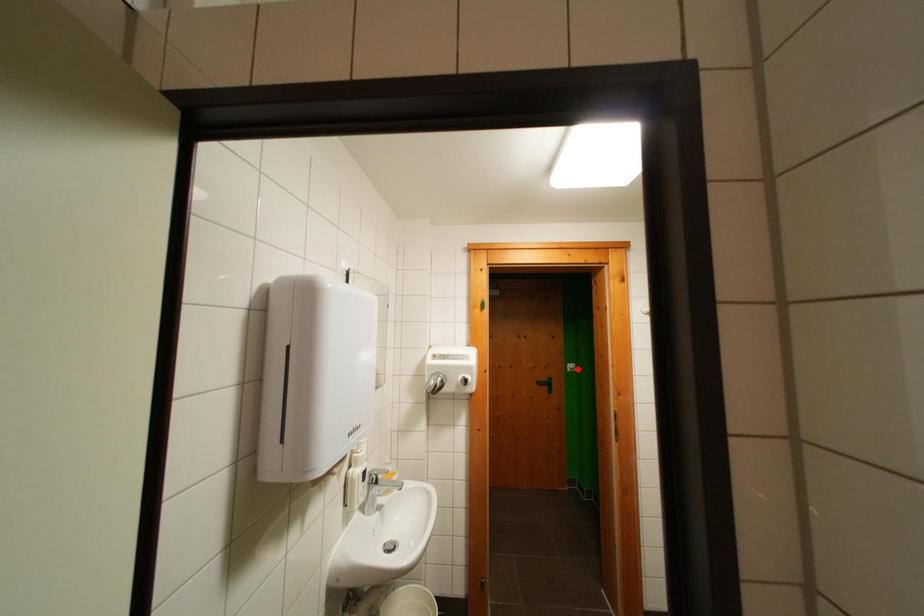
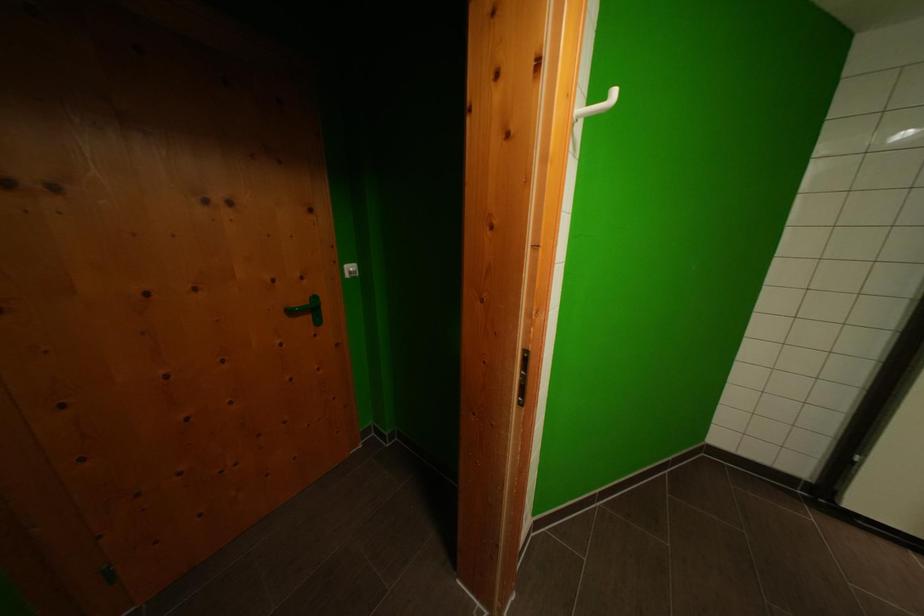
In the second image, find the point that corresponds to the highlighted location in the first image.

(358, 272)